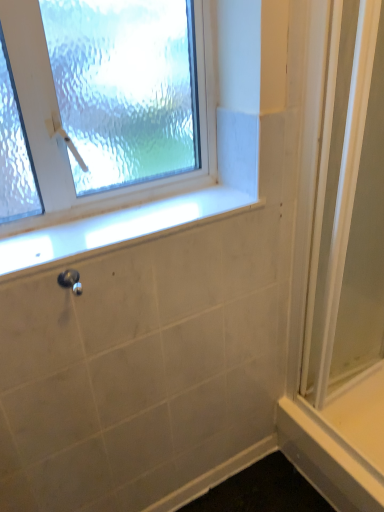
Question: Does clear glass screen door at right have a lesser width compared to white marble window sill at center?

Choices:
 (A) no
 (B) yes

Answer: (B)

Question: Is white marble window sill at center located within clear glass screen door at right?

Choices:
 (A) yes
 (B) no

Answer: (B)

Question: Can you confirm if clear glass screen door at right is shorter than white marble window sill at center?

Choices:
 (A) yes
 (B) no

Answer: (B)

Question: Is clear glass screen door at right taller than white marble window sill at center?

Choices:
 (A) yes
 (B) no

Answer: (A)

Question: Is clear glass screen door at right smaller than white marble window sill at center?

Choices:
 (A) no
 (B) yes

Answer: (A)

Question: From their relative heights in the image, would you say clear glass window at upper left is taller or shorter than clear glass screen door at right?

Choices:
 (A) short
 (B) tall

Answer: (A)

Question: Is clear glass window at upper left inside or outside of clear glass screen door at right?

Choices:
 (A) outside
 (B) inside

Answer: (A)

Question: From a real-world perspective, is clear glass window at upper left physically located above or below clear glass screen door at right?

Choices:
 (A) above
 (B) below

Answer: (A)

Question: Looking at their shapes, would you say clear glass window at upper left is wider or thinner than clear glass screen door at right?

Choices:
 (A) wide
 (B) thin

Answer: (A)

Question: Is white marble window sill at center inside or outside of white smooth ledge at lower right?

Choices:
 (A) outside
 (B) inside

Answer: (A)

Question: In terms of size, does white marble window sill at center appear bigger or smaller than white smooth ledge at lower right?

Choices:
 (A) small
 (B) big

Answer: (A)

Question: From their relative heights in the image, would you say white marble window sill at center is taller or shorter than white smooth ledge at lower right?

Choices:
 (A) short
 (B) tall

Answer: (A)

Question: Does point (89, 248) appear closer or farther from the camera than point (329, 485)?

Choices:
 (A) farther
 (B) closer

Answer: (B)

Question: Is white marble window sill at center spatially inside clear glass screen door at right, or outside of it?

Choices:
 (A) inside
 (B) outside

Answer: (B)

Question: Is white marble window sill at center bigger or smaller than clear glass screen door at right?

Choices:
 (A) big
 (B) small

Answer: (B)